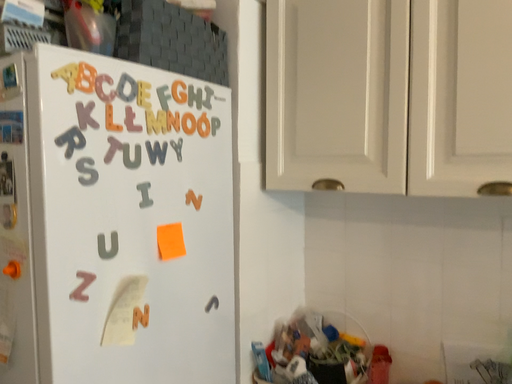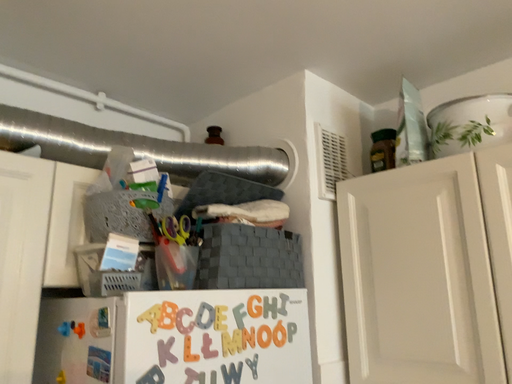
Question: Which way did the camera rotate in the video?

Choices:
 (A) rotated right
 (B) rotated left

Answer: (B)